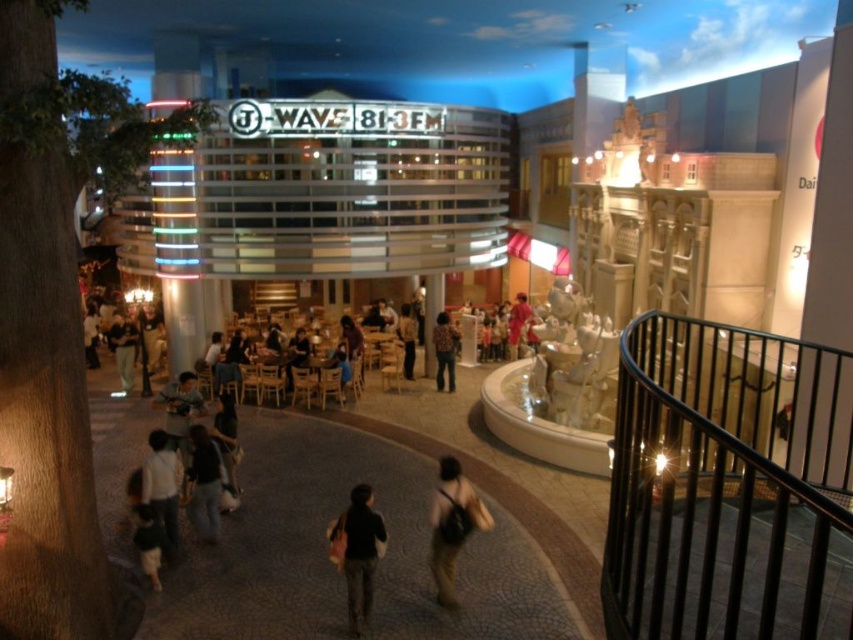
You are a customer at the mall and see the dark gray backpack at center and the dark gray sweater at lower left. Which item is placed above the other?

The dark gray backpack at center is positioned over the dark gray sweater at lower left.

You are at the mall and need to retrieve your belongings. You remember leaving a light brown leather backpack at center and a white cotton shirt at lower left. Based on the scene description, which item is closer to the ground?

The light brown leather backpack at center is closer to the ground since it is located below the white cotton shirt at lower left.